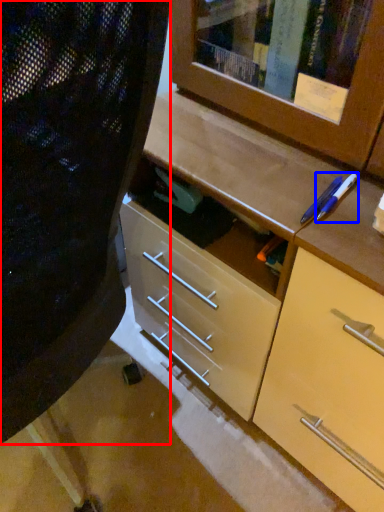
Question: Among these objects, which one is farthest to the camera, folding chair (highlighted by a red box) or pencil (highlighted by a blue box)?

Choices:
 (A) folding chair
 (B) pencil

Answer: (B)